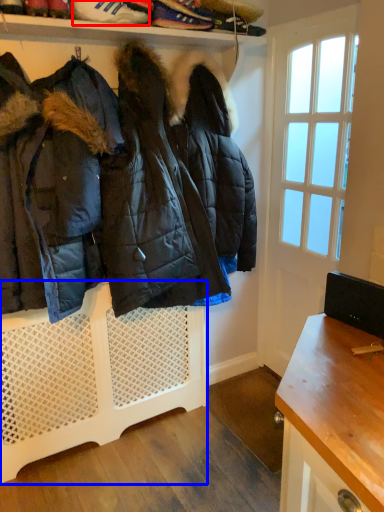
Question: Which point is further to the camera, footwear (highlighted by a red box) or shelf (highlighted by a blue box)?

Choices:
 (A) footwear
 (B) shelf

Answer: (B)